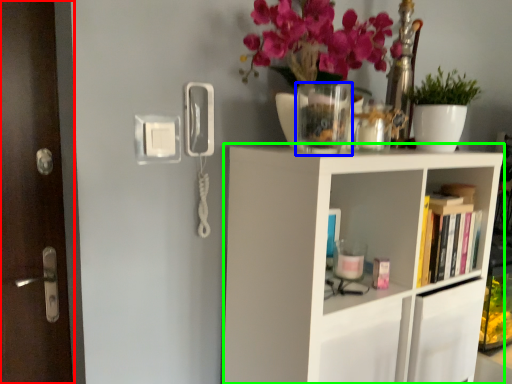
Question: Estimate the real-world distances between objects in this image. Which object is closer to door (highlighted by a red box), glass vase (highlighted by a blue box) or shelf (highlighted by a green box)?

Choices:
 (A) glass vase
 (B) shelf

Answer: (A)